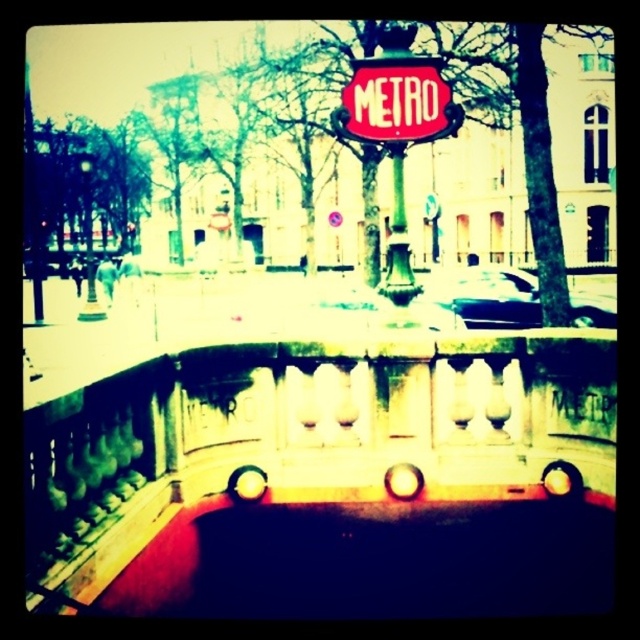
Can you confirm if red glossy metro sign at center is thinner than green polished metal pole at center?

No.

What do you see at coordinates (396, 102) in the screenshot?
I see `red glossy metro sign at center` at bounding box center [396, 102].

This screenshot has height=640, width=640. In order to click on red glossy metro sign at center in this screenshot , I will do `click(396, 102)`.

Is shiny black car at center below green polished metal pole at center?

Yes, shiny black car at center is below green polished metal pole at center.

Is point (525, 308) farther from viewer compared to point (396, 243)?

Yes, it is behind point (396, 243).

Which is behind, point (509, 324) or point (397, 257)?

The point (509, 324) is behind.

Find the location of a particular element. shiny black car at center is located at coordinates (486, 296).

Between point (292, 451) and point (403, 164), which one is positioned in front?

Point (292, 451) is in front.

Is point (508, 348) positioned after point (403, 156)?

No.

Identify the location of stone balustrade at center. This screenshot has width=640, height=640. (310, 435).